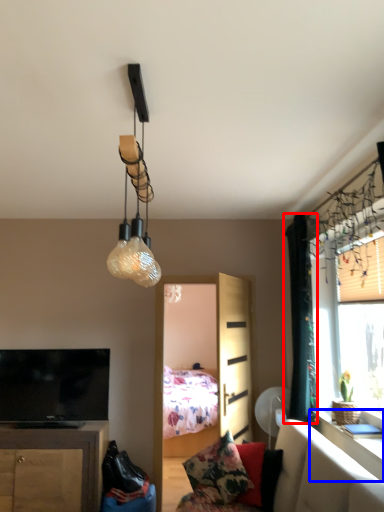
Question: Which object is further to the camera taking this photo, curtain (highlighted by a red box) or table (highlighted by a blue box)?

Choices:
 (A) curtain
 (B) table

Answer: (A)